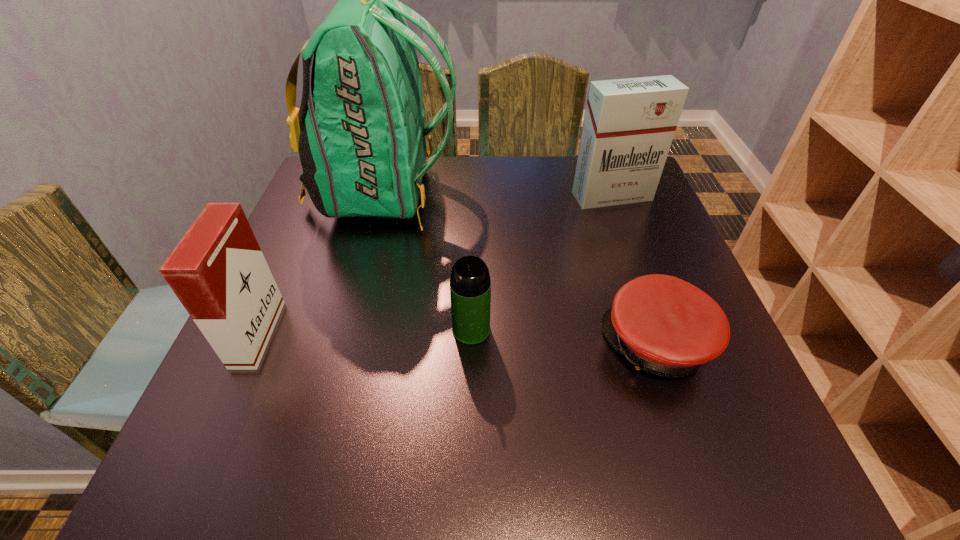
Find the location of a particular element. free space that is in between the right cigarette_case and the shortest object is located at coordinates (635, 271).

The height and width of the screenshot is (540, 960). What are the coordinates of `vacant area that lies between the backpack and the taller cigarette_case` in the screenshot? It's located at (498, 194).

At what (x,y) coordinates should I click in order to perform the action: click on free space between the shortest object and the taller cigarette_case. Please return your answer as a coordinate pair (x, y). Looking at the image, I should click on (635, 271).

Find the location of a particular element. This screenshot has width=960, height=540. vacant area between the cap and the thermos bottle is located at coordinates (564, 337).

Locate an element on the screen. empty space that is in between the tallest object and the thermos bottle is located at coordinates (428, 261).

Image resolution: width=960 pixels, height=540 pixels. In order to click on free point between the nearer cigarette_case and the thermos bottle in this screenshot , I will do `click(365, 332)`.

Identify the location of empty location between the nearer cigarette_case and the fourth tallest object. Image resolution: width=960 pixels, height=540 pixels. (365, 332).

Locate which object ranks second in proximity to the thermos bottle. Please provide its 2D coordinates. Your answer should be formatted as a tuple, i.e. [(x, y)], where the tuple contains the x and y coordinates of a point satisfying the conditions above.

[(360, 134)]

Find the location of a particular element. The width and height of the screenshot is (960, 540). object that ranks as the closest to the shorter cigarette_case is located at coordinates (360, 134).